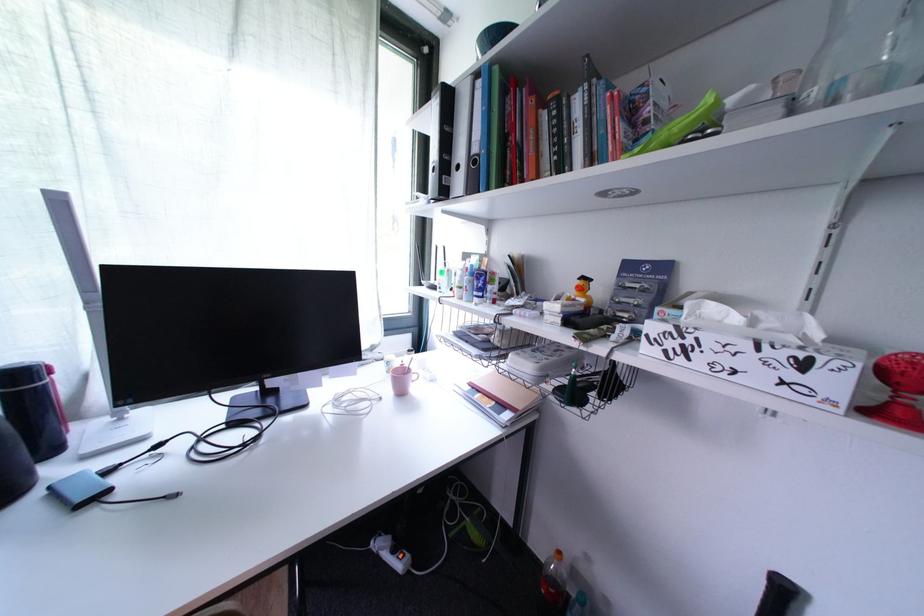
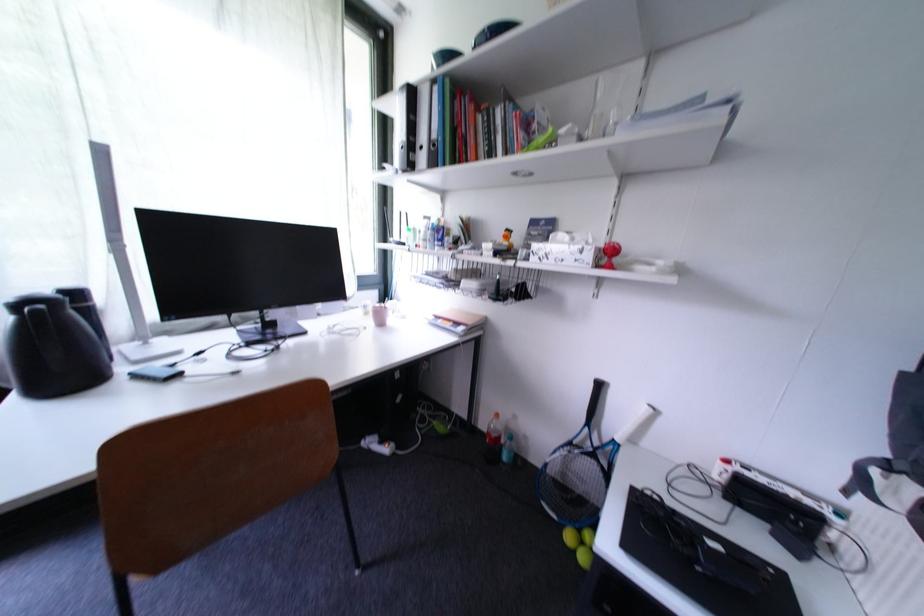
Find the pixel in the second image that matches pixel 439 124 in the first image.

(405, 110)